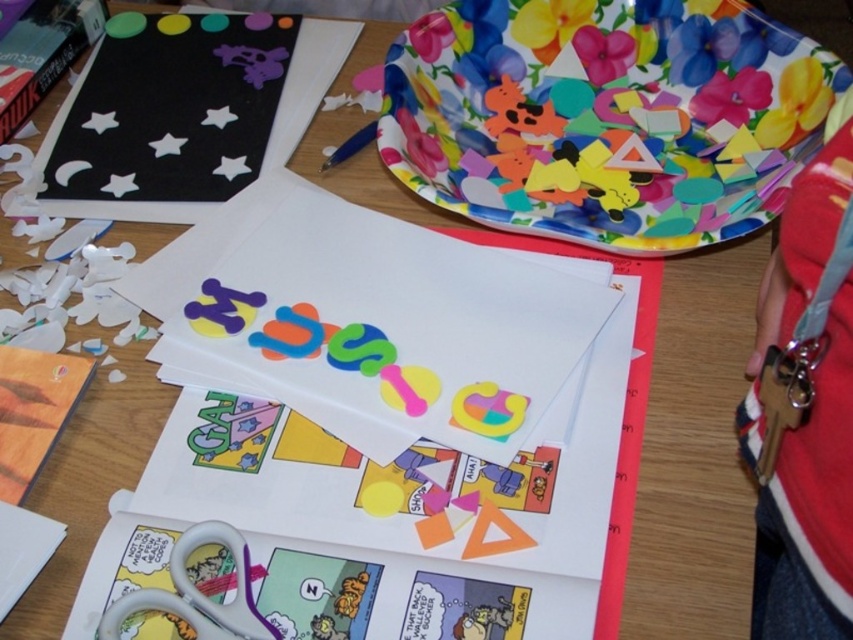
Does floral paper plate at upper right have a smaller size compared to matte paper at center?

No, floral paper plate at upper right is not smaller than matte paper at center.

Is floral paper plate at upper right shorter than matte paper at center?

No.

Does point (581, 236) lie in front of point (320, 381)?

That is False.

Locate an element on the screen. The width and height of the screenshot is (853, 640). floral paper plate at upper right is located at coordinates click(x=605, y=116).

Which is more to the left, floral paper plate at upper right or white plastic scissors at lower left?

Positioned to the left is white plastic scissors at lower left.

Can you confirm if floral paper plate at upper right is positioned above white plastic scissors at lower left?

Yes, floral paper plate at upper right is above white plastic scissors at lower left.

Describe the element at coordinates (605, 116) in the screenshot. I see `floral paper plate at upper right` at that location.

Locate an element on the screen. This screenshot has width=853, height=640. floral paper plate at upper right is located at coordinates (605, 116).

Is matte paper at center thinner than white plastic scissors at lower left?

No, matte paper at center is not thinner than white plastic scissors at lower left.

How far apart are matte paper at center and white plastic scissors at lower left?

A distance of 6.79 inches exists between matte paper at center and white plastic scissors at lower left.

Is point (321, 422) in front of point (213, 628)?

No, it is not.

At what (x,y) coordinates should I click in order to perform the action: click on matte paper at center. Please return your answer as a coordinate pair (x, y). The image size is (853, 640). Looking at the image, I should click on (369, 321).